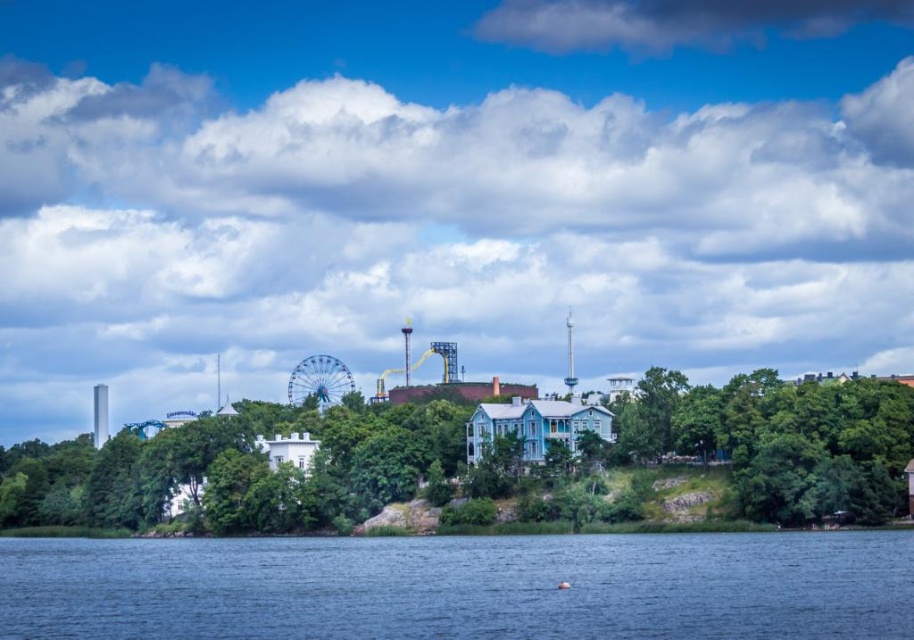
Which is behind, point (293, 464) or point (803, 508)?

Positioned behind is point (293, 464).

Locate an element on the screen. Image resolution: width=914 pixels, height=640 pixels. metallic ferris wheel at center is located at coordinates (479, 458).

How much distance is there between blue water at lower center and green leafy trees at right?

blue water at lower center and green leafy trees at right are 28.09 meters apart from each other.

Which is in front, point (104, 579) or point (652, 438)?

Positioned in front is point (104, 579).

Where is `blue water at lower center`? The image size is (914, 640). blue water at lower center is located at coordinates (461, 588).

Can you confirm if metallic ferris wheel at center is positioned to the right of blue water at lower center?

In fact, metallic ferris wheel at center is to the left of blue water at lower center.

Between metallic ferris wheel at center and blue water at lower center, which one appears on the right side from the viewer's perspective?

blue water at lower center is more to the right.

Who is more distant from viewer, (592, 467) or (411, 547)?

Point (592, 467)

Where is `metallic ferris wheel at center`? metallic ferris wheel at center is located at coordinates (479, 458).